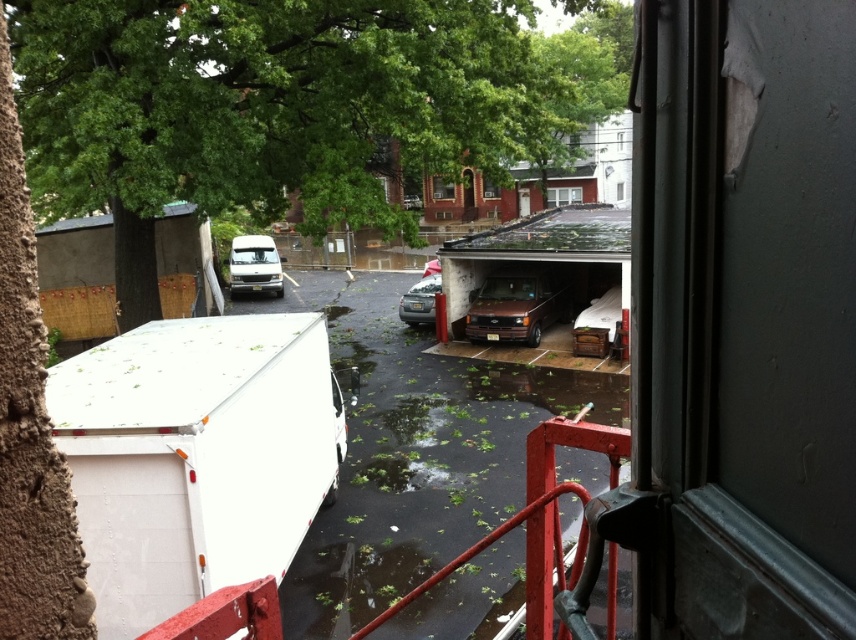
You are a delivery person trying to park your van in the parking lot. You see the green leafy tree at upper left and the white matte van at center. Which object is taller and could potentially block sunlight from reaching your van if parked there?

The green leafy tree at upper left is taller than the white matte van at center, so it could potentially block sunlight from reaching your van if parked there.

You are a delivery person needing to park your 2.5 meter wide truck between the brown matte van at center and the white matte van at center in the parking lot. Can your truck fit in the space between them?

The distance between the brown matte van at center and the white matte van at center is 11.64 meters. Since your truck is only 2.5 meters wide, there is more than enough space to park between them.